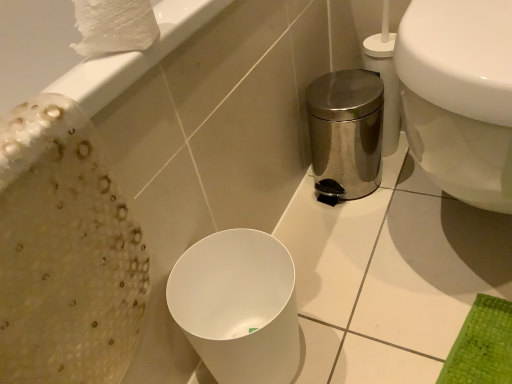
The image size is (512, 384). Find the location of `white matte bidet at center`. white matte bidet at center is located at coordinates (238, 306).

I want to click on white textured toilet paper at upper left, so click(x=114, y=26).

Which is in front, white glossy toilet at right or white matte bidet at center?

Positioned in front is white glossy toilet at right.

Can you tell me how much white glossy toilet at right and white matte bidet at center differ in facing direction?

The angular difference between white glossy toilet at right and white matte bidet at center is 90.7 degrees.

From the image's perspective, between white glossy toilet at right and white matte bidet at center, who is located below?

white matte bidet at center, from the image's perspective.

Is white glossy toilet at right positioned beyond the bounds of white matte bidet at center?

Yes, white glossy toilet at right is not within white matte bidet at center.

From a real-world perspective, which object stands above the other?

From a 3D spatial view, white textured toilet paper at upper left is above.

Considering the relative positions of white glossy toilet at right and white textured toilet paper at upper left in the image provided, is white glossy toilet at right to the left of white textured toilet paper at upper left from the viewer's perspective?

Incorrect, white glossy toilet at right is not on the left side of white textured toilet paper at upper left.

Is white glossy toilet at right beside white textured toilet paper at upper left?

No, white glossy toilet at right is not making contact with white textured toilet paper at upper left.

How many degrees apart are the facing directions of white textured toilet paper at upper left and white matte bidet at center?

The angle between the facing direction of white textured toilet paper at upper left and the facing direction of white matte bidet at center is 0.00198 degrees.

Which object is thinner, white textured toilet paper at upper left or white matte bidet at center?

Thinner between the two is white textured toilet paper at upper left.

From a real-world perspective, which is physically below, white textured toilet paper at upper left or white matte bidet at center?

In real-world perspective, white matte bidet at center is lower.

Is white textured toilet paper at upper left aimed at white matte bidet at center?

No, white textured toilet paper at upper left is not turned towards white matte bidet at center.

From the image's perspective, is white matte bidet at center positioned above or below white textured toilet paper at upper left?

Clearly, from the image's perspective, white matte bidet at center is below white textured toilet paper at upper left.

Does white matte bidet at center have a larger size compared to white textured toilet paper at upper left?

Indeed, white matte bidet at center has a larger size compared to white textured toilet paper at upper left.

How different are the orientations of white matte bidet at center and white textured toilet paper at upper left in degrees?

The facing directions of white matte bidet at center and white textured toilet paper at upper left are 0.00198 degrees apart.

Who is more distant, white matte bidet at center or white textured toilet paper at upper left?

Positioned behind is white matte bidet at center.

Would you say white textured toilet paper at upper left is to the left or to the right of white glossy toilet at right in the picture?

white textured toilet paper at upper left is to the left of white glossy toilet at right.

Is white textured toilet paper at upper left positioned before white glossy toilet at right?

No, it is not.

How different are the orientations of white textured toilet paper at upper left and white glossy toilet at right in degrees?

There is a 90.7-degree angle between the facing directions of white textured toilet paper at upper left and white glossy toilet at right.

How much distance is there between white textured toilet paper at upper left and white glossy toilet at right?

A distance of 15.76 inches exists between white textured toilet paper at upper left and white glossy toilet at right.

Which object is wider, white matte bidet at center or white glossy toilet at right?

Wider between the two is white glossy toilet at right.

Considering the positions of objects white matte bidet at center and white glossy toilet at right in the image provided, who is more to the left, white matte bidet at center or white glossy toilet at right?

white matte bidet at center.

Is point (226, 310) closer to camera compared to point (483, 19)?

No, it is behind (483, 19).

Who is shorter, white matte bidet at center or white glossy toilet at right?

With less height is white matte bidet at center.

Identify the location of toilet on the right of the white matte bidet at center. The height and width of the screenshot is (384, 512). (459, 96).

This screenshot has height=384, width=512. I want to click on toilet below the white textured toilet paper at upper left (from a real-world perspective), so click(459, 96).

Considering their positions, is white textured toilet paper at upper left positioned further to white matte bidet at center than white glossy toilet at right?

white textured toilet paper at upper left is further to white matte bidet at center.

Based on the photo, considering their positions, is white textured toilet paper at upper left positioned further to white glossy toilet at right than white matte bidet at center?

white textured toilet paper at upper left.

In the scene shown: Looking at the image, which one is located closer to white glossy toilet at right, white matte bidet at center or white textured toilet paper at upper left?

white matte bidet at center is positioned closer to the anchor white glossy toilet at right.

Estimate the real-world distances between objects in this image. Which object is further from white textured toilet paper at upper left, white glossy toilet at right or white matte bidet at center?

white matte bidet at center lies further to white textured toilet paper at upper left than the other object.

Estimate the real-world distances between objects in this image. Which object is further from white textured toilet paper at upper left, white matte bidet at center or white glossy toilet at right?

white matte bidet at center.

Considering their positions, is white glossy toilet at right positioned further to white matte bidet at center than white textured toilet paper at upper left?

white textured toilet paper at upper left.

Find the location of a particular element. The width and height of the screenshot is (512, 384). bidet between white textured toilet paper at upper left and white glossy toilet at right in the horizontal direction is located at coordinates (238, 306).